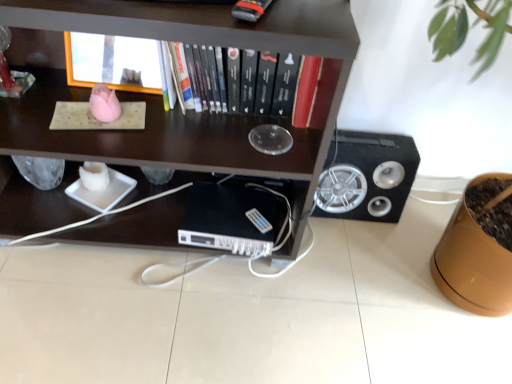
Identify the location of free spot in front of black matte speaker at right. This screenshot has height=384, width=512. (359, 253).